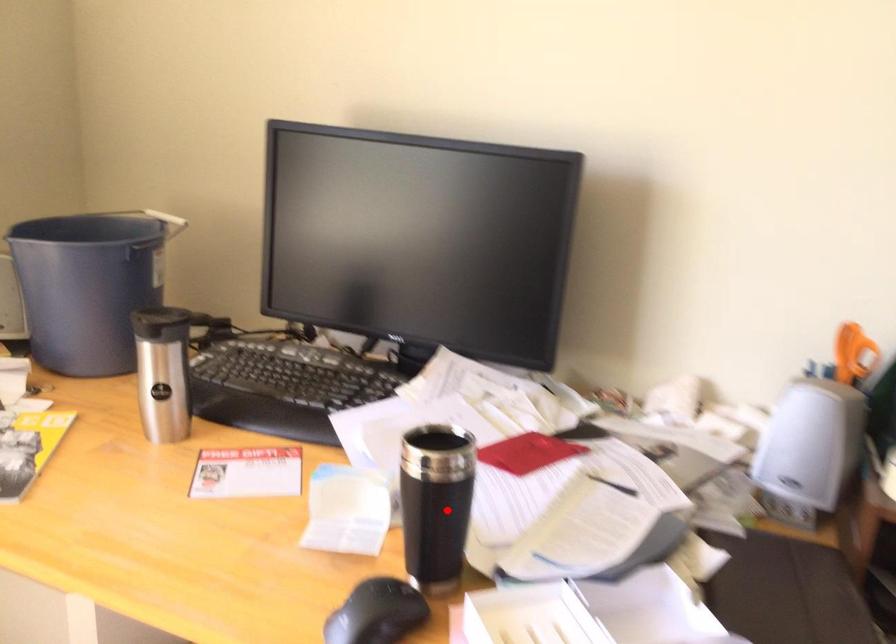
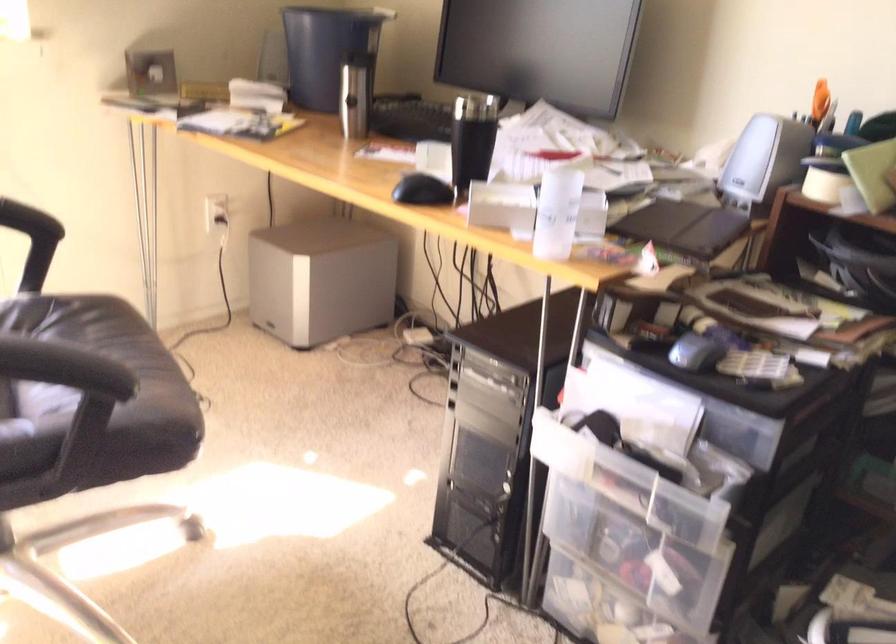
Question: I am providing you with two images of the same scene from different viewpoints. Given a red point in image1, look at the same physical point in image2. Is it:

Choices:
 (A) Closer to the viewpoint
 (B) Farther from the viewpoint

Answer: (B)